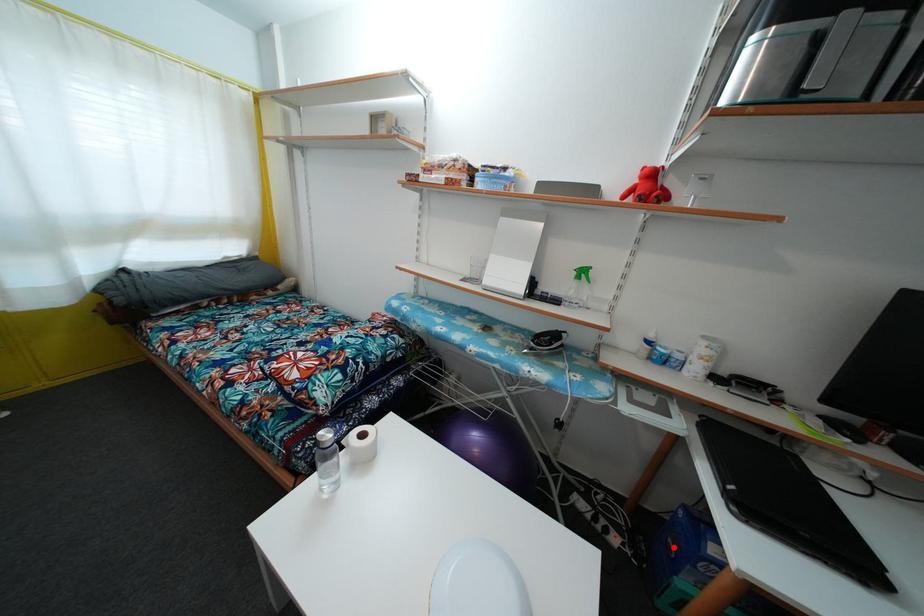
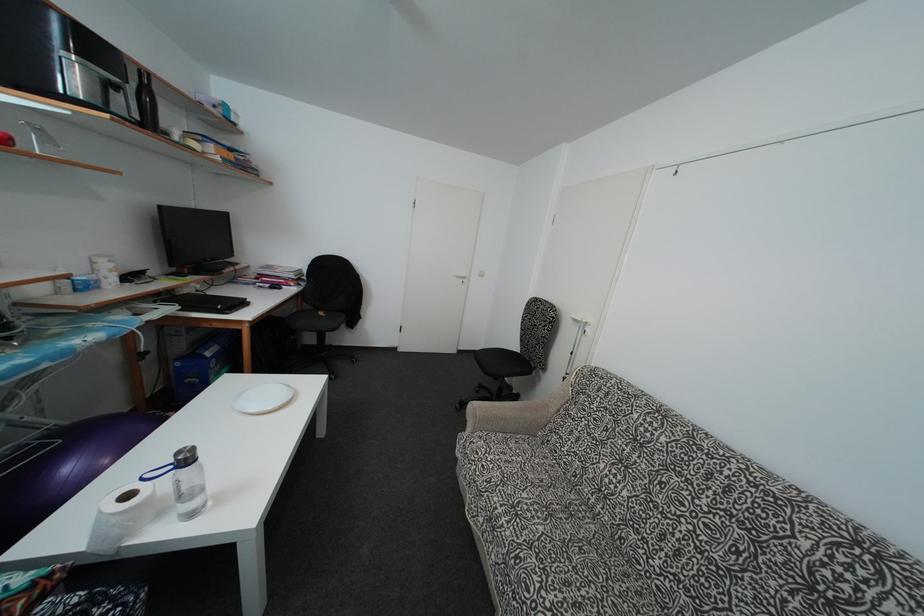
Question: I am providing you with two images of the same scene from different viewpoints. In image1, a red point is highlighted. Considering the same 3D point in image2, which of the following is correct?

Choices:
 (A) It is closer
 (B) It is farther

Answer: (B)